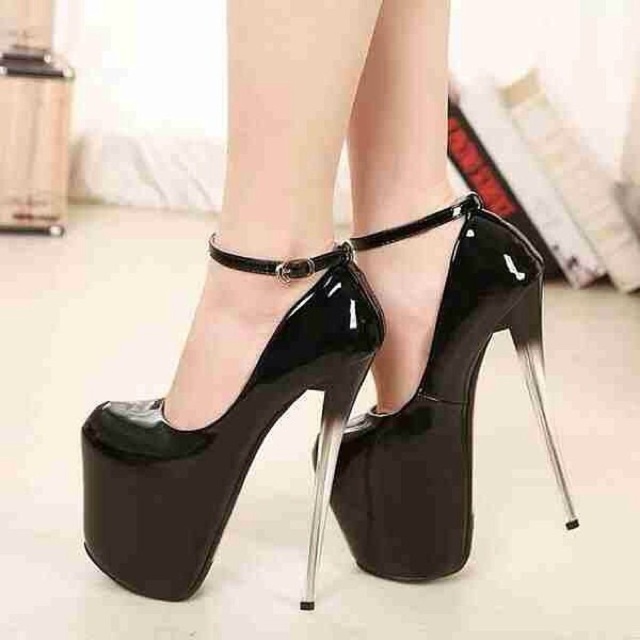
You are standing in a room and see the black glossy platform shoe at center. If you want to touch it without moving your feet, is it within your reach? Assume your outstretched hand can reach 28 inches.

The black glossy platform shoe at center is 29.50 inches away from viewer, which is beyond the 28 inches reach of an outstretched hand. Therefore, you cannot touch it without moving your feet.

You are standing in the room and want to place a 12 inch tall sculpture on the floor. The point where you want to place it is at coordinates point (374, 272). Given that you are 37.57 inches away from this point, can you reach it without moving your feet?

The distance between you and the point (374, 272) is 37.57 inches. Since the sculpture is 12 inches tall, your reach might be limited. Typically, a person can reach about 24 to 30 inches in front without moving their feet. Therefore, placing the sculpture at 37.57 inches away may be out of reach unless you stretch or move closer.

You are a shoe designer evaluating two pairs of shoes in the image. The black glossy platform shoe at center and the black patent leather sandal at center. Which one has a taller heel?

The black glossy platform shoe at center has a greater height compared to the black patent leather sandal at center, so the black glossy platform shoe at center has a taller heel.